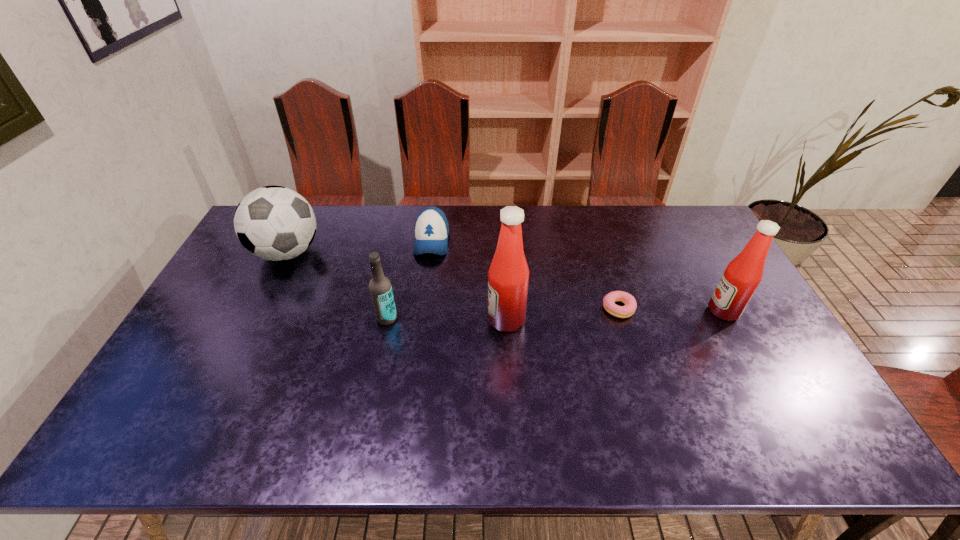
Identify the location of free space that satisfies the following two spatial constraints: 1. on the main logo of the soccer ball; 2. on the right side of the second object from right to left. This screenshot has width=960, height=540. (259, 308).